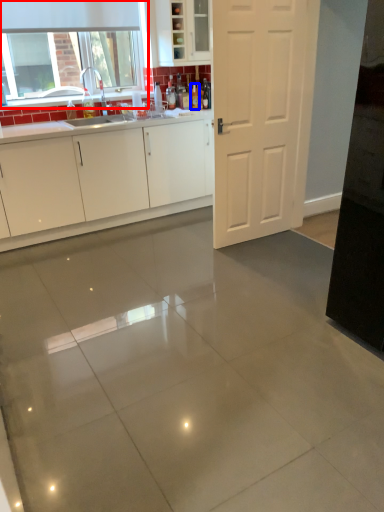
Question: Which object is closer to the camera taking this photo, window (highlighted by a red box) or bottle (highlighted by a blue box)?

Choices:
 (A) window
 (B) bottle

Answer: (A)